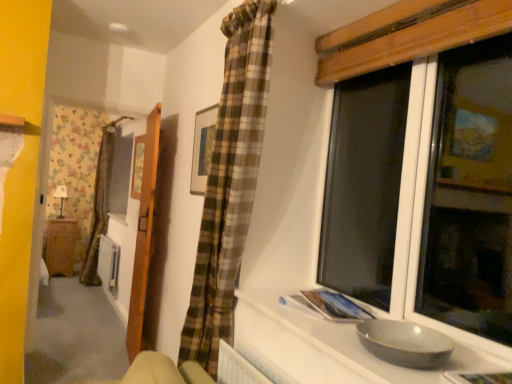
Question: Considering the relative positions of matte black lamp at left and gray matte bowl at lower right in the image provided, is matte black lamp at left to the left of gray matte bowl at lower right from the viewer's perspective?

Choices:
 (A) yes
 (B) no

Answer: (A)

Question: Would you say matte black lamp at left is outside gray matte bowl at lower right?

Choices:
 (A) yes
 (B) no

Answer: (A)

Question: Considering the relative sizes of matte black lamp at left and gray matte bowl at lower right in the image provided, is matte black lamp at left smaller than gray matte bowl at lower right?

Choices:
 (A) no
 (B) yes

Answer: (B)

Question: Considering the relative sizes of matte black lamp at left and gray matte bowl at lower right in the image provided, is matte black lamp at left thinner than gray matte bowl at lower right?

Choices:
 (A) no
 (B) yes

Answer: (B)

Question: Is the position of matte black lamp at left less distant than that of gray matte bowl at lower right?

Choices:
 (A) no
 (B) yes

Answer: (A)

Question: Considering the relative sizes of matte black lamp at left and gray matte bowl at lower right in the image provided, is matte black lamp at left shorter than gray matte bowl at lower right?

Choices:
 (A) no
 (B) yes

Answer: (A)

Question: Can you confirm if wooden door at left is bigger than matte black lamp at left?

Choices:
 (A) yes
 (B) no

Answer: (A)

Question: Can you confirm if wooden door at left is wider than matte black lamp at left?

Choices:
 (A) yes
 (B) no

Answer: (B)

Question: Is wooden door at left in contact with matte black lamp at left?

Choices:
 (A) no
 (B) yes

Answer: (A)

Question: Is wooden door at left at the right side of matte black lamp at left?

Choices:
 (A) no
 (B) yes

Answer: (B)

Question: Is wooden door at left not within matte black lamp at left?

Choices:
 (A) yes
 (B) no

Answer: (A)

Question: Is matte black lamp at left completely or partially inside wooden door at left?

Choices:
 (A) yes
 (B) no

Answer: (B)

Question: Does wooden cabinet at left have a lesser height compared to matte black lamp at left?

Choices:
 (A) no
 (B) yes

Answer: (A)